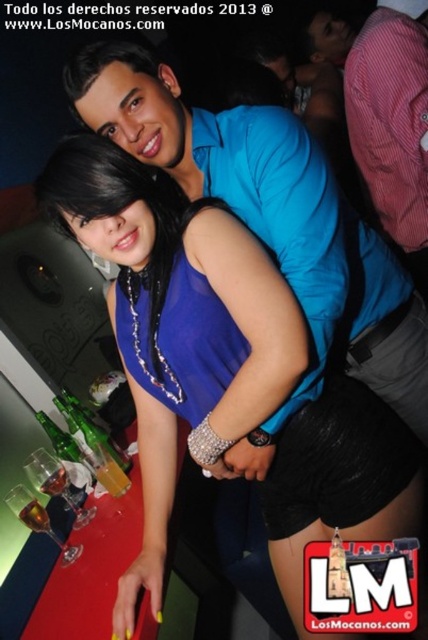
You are a photographer at the nightclub scene. You need to adjust the lighting to highlight the satin blue dress at center. Where exactly should you focus the light?

The satin blue dress at center is located at point (175, 321), so you should focus the light there to highlight it.

You are a photographer at a party and need to capture a closeup shot of both the satin blue dress at center and the blue shirt at upper center without any overlap. Given that your camera has a maximum focus range of 30 inches, will you be able to achieve this?

The satin blue dress at center and blue shirt at upper center are 30.46 inches apart. Since the distance between them exceeds the camera maximum focus range of 30 inches, you cannot capture both without overlap.

You are a photographer at a party. You need to position a light to the right of both the satin blue dress at center and the blue shirt at upper center. Is this possible given their positions?

The satin blue dress at center is to the left of the blue shirt at upper center, so positioning a light to the right of both would be possible as they are arranged horizontally with space to their right.